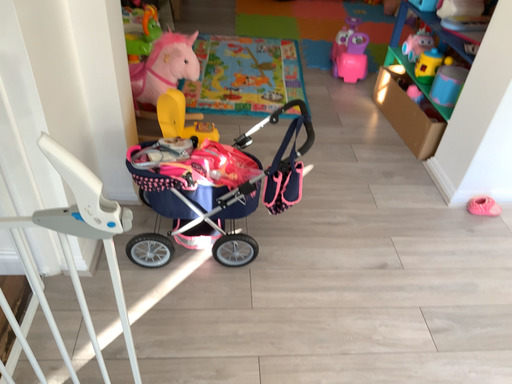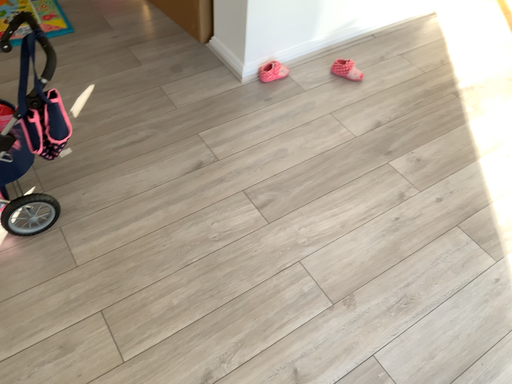
Question: How did the camera likely rotate when shooting the video?

Choices:
 (A) rotated right
 (B) rotated left

Answer: (A)